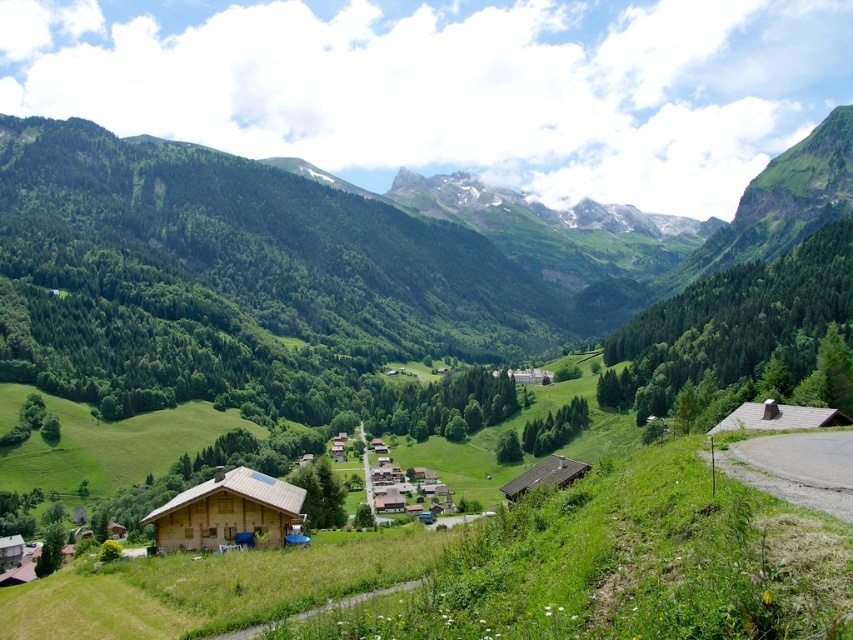
You are standing at the center of the dirt path in the valley. You see the wooden cabin at lower left and the wooden cabin at lower right. Which cabin is closer to you?

The wooden cabin at lower left is positioned under the wooden cabin at lower right, so the wooden cabin at lower left is closer to you.

You are standing at the base of the valley and want to reach the wooden cabin at center. There is a brown wooden hut at lower right blocking your path. Can you walk around it to reach your destination?

The brown wooden hut at lower right is above the wooden cabin at center, so you can walk around it to reach the wooden cabin at center.